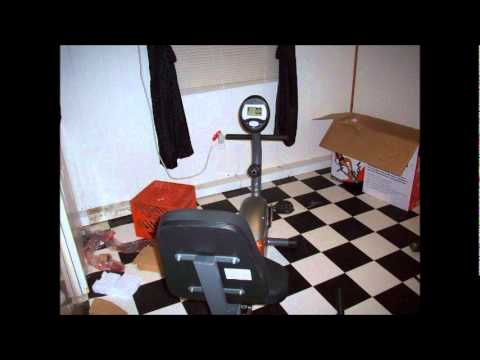
Identify the location of cardboard box. (360, 148).